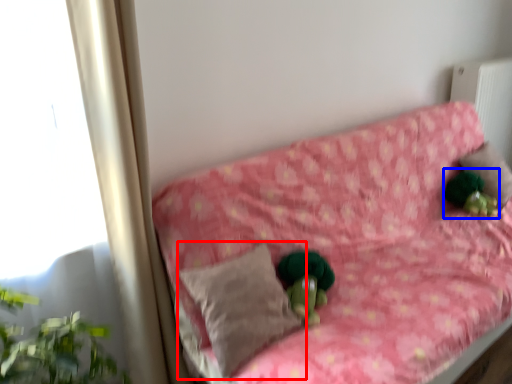
Question: Among these objects, which one is nearest to the camera, pillow (highlighted by a red box) or figurine (highlighted by a blue box)?

Choices:
 (A) pillow
 (B) figurine

Answer: (A)